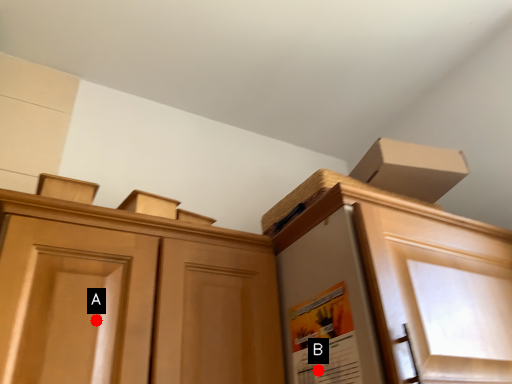
Question: Two points are circled on the image, labeled by A and B beside each circle. Which of the following is the closest to the observer?

Choices:
 (A) A is closer
 (B) B is closer

Answer: (A)